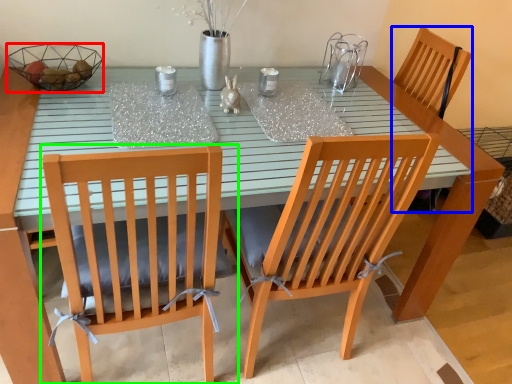
Question: Which object is the farthest from glass bowl (highlighted by a red box)? Choose among these: armchair (highlighted by a blue box) or chair (highlighted by a green box).

Choices:
 (A) armchair
 (B) chair

Answer: (A)